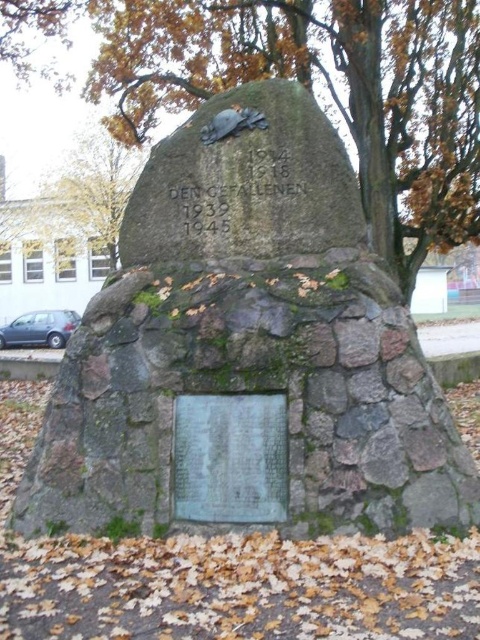
Question: Can you confirm if green mossy stone monument at center is positioned to the left of green mossy stone monument at upper center?

Choices:
 (A) no
 (B) yes

Answer: (A)

Question: Among these objects, which one is nearest to the camera?

Choices:
 (A) green mossy stone monument at center
 (B) green mossy stone monument at upper center

Answer: (A)

Question: Which point is closer to the camera?

Choices:
 (A) (385, 513)
 (B) (190, 422)
 (C) (471, 221)

Answer: (A)

Question: Does green mossy stone monument at upper center appear on the left side of bronze plaque at center?

Choices:
 (A) no
 (B) yes

Answer: (B)

Question: Does green mossy stone monument at center come behind green mossy stone monument at upper center?

Choices:
 (A) yes
 (B) no

Answer: (B)

Question: Which point is farther to the camera?

Choices:
 (A) (373, 99)
 (B) (186, 451)
 (C) (215, 193)

Answer: (A)